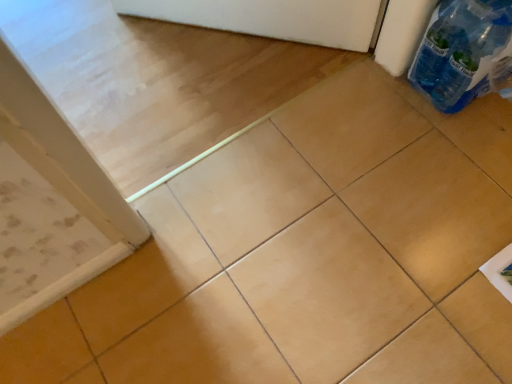
This screenshot has height=384, width=512. Identify the location of blue plastic bottle at upper right. (463, 52).

Describe the element at coordinates (463, 52) in the screenshot. I see `blue plastic bottle at upper right` at that location.

Locate an element on the screen. The image size is (512, 384). blue plastic bottle at upper right is located at coordinates (463, 52).